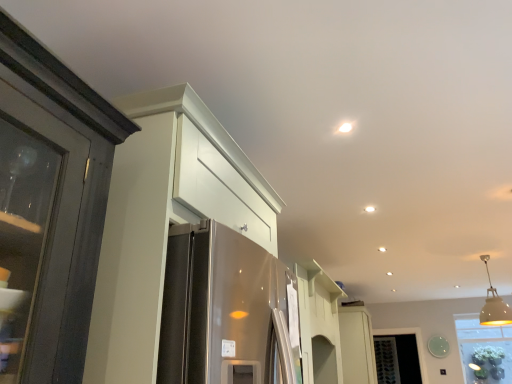
Measure the distance between point (x=505, y=312) and camera.

Point (x=505, y=312) is 4.32 meters from camera.

Identify the location of white glossy cabinet at upper left, acting as the 2th cabinetry starting from the back. (165, 221).

Is point (496, 316) positioned after point (360, 319)?

No, it is not.

Is white matte pendant light at upper right bigger than white glossy cabinet at center, the 1th cabinetry when ordered from back to front?

Incorrect, white matte pendant light at upper right is not larger than white glossy cabinet at center, the 1th cabinetry when ordered from back to front.

Is white matte pendant light at upper right next to white glossy cabinet at center, marked as the second cabinetry in a left-to-right arrangement?

No, white matte pendant light at upper right is not in contact with white glossy cabinet at center, marked as the second cabinetry in a left-to-right arrangement.

Is white glossy cabinet at center, the first cabinetry positioned from the bottom, located outside white glossy cabinet at upper left, acting as the first cabinetry starting from the front?

white glossy cabinet at center, the first cabinetry positioned from the bottom, lies outside white glossy cabinet at upper left, acting as the first cabinetry starting from the front,'s area.

From a real-world perspective, who is located lower, white glossy cabinet at center, marked as the second cabinetry in a left-to-right arrangement, or white glossy cabinet at upper left, the second cabinetry when ordered from bottom to top?

In real-world perspective, white glossy cabinet at center, marked as the second cabinetry in a left-to-right arrangement, is lower.

This screenshot has height=384, width=512. Identify the location of cabinetry above the white glossy cabinet at center, the first cabinetry positioned from the bottom (from a real-world perspective). (165, 221).

Can you confirm if white glossy cabinet at center, which is the 2th cabinetry in front-to-back order, is positioned to the left of white glossy cabinet at upper left, which ranks as the first cabinetry in top-to-bottom order?

No.

Consider the image. Is white glossy cabinet at upper left, the second cabinetry when ordered from bottom to top, outside of white matte pendant light at upper right?

Indeed, white glossy cabinet at upper left, the second cabinetry when ordered from bottom to top, is completely outside white matte pendant light at upper right.

In terms of width, does white glossy cabinet at upper left, the 1th cabinetry positioned from the left, look wider or thinner when compared to white matte pendant light at upper right?

Considering their sizes, white glossy cabinet at upper left, the 1th cabinetry positioned from the left, looks broader than white matte pendant light at upper right.

In the image, is white glossy cabinet at upper left, acting as the first cabinetry starting from the front, positioned in front of or behind white matte pendant light at upper right?

white glossy cabinet at upper left, acting as the first cabinetry starting from the front, is in front of white matte pendant light at upper right.

Can you confirm if white glossy cabinet at center, the 1th cabinetry when ordered from back to front, is positioned to the right of white matte pendant light at upper right?

In fact, white glossy cabinet at center, the 1th cabinetry when ordered from back to front, is to the left of white matte pendant light at upper right.

From the image's perspective, which object appears higher, white glossy cabinet at center, which is the 2th cabinetry in front-to-back order, or white matte pendant light at upper right?

white matte pendant light at upper right.

Considering the points (347, 344) and (489, 312), which point is in front, point (347, 344) or point (489, 312)?

The point (489, 312) is closer.

How different are the orientations of white glossy cabinet at center, the 1th cabinetry positioned from the right, and white matte pendant light at upper right in degrees?

They differ by 87.9 degrees in their facing directions.

Which is closer to the camera, (500, 306) or (264, 185)?

Point (500, 306) appears to be farther away from the viewer than point (264, 185).

From a real-world perspective, is white matte pendant light at upper right below white glossy cabinet at upper left, acting as the 2th cabinetry starting from the back?

Incorrect, from a real-world perspective, white matte pendant light at upper right is higher than white glossy cabinet at upper left, acting as the 2th cabinetry starting from the back.

Measure the distance between white matte pendant light at upper right and white glossy cabinet at upper left, the 1th cabinetry positioned from the left.

The distance of white matte pendant light at upper right from white glossy cabinet at upper left, the 1th cabinetry positioned from the left, is 3.87 meters.

How many degrees apart are the facing directions of white matte pendant light at upper right and white glossy cabinet at upper left, positioned as the second cabinetry in right-to-left order?

The angular difference between white matte pendant light at upper right and white glossy cabinet at upper left, positioned as the second cabinetry in right-to-left order, is 87.4 degrees.

From a real-world perspective, between white glossy cabinet at upper left, the second cabinetry when ordered from bottom to top, and white glossy cabinet at center, marked as the second cabinetry in a left-to-right arrangement, who is vertically lower?

white glossy cabinet at center, marked as the second cabinetry in a left-to-right arrangement, is physically lower.

Who is shorter, white glossy cabinet at upper left, the second cabinetry when ordered from bottom to top, or white glossy cabinet at center, the 1th cabinetry when ordered from back to front?

Standing shorter between the two is white glossy cabinet at upper left, the second cabinetry when ordered from bottom to top.

Choose the correct answer: Is white glossy cabinet at upper left, the 1th cabinetry positioned from the left, inside white glossy cabinet at center, which ranks as the second cabinetry in top-to-bottom order, or outside it?

white glossy cabinet at upper left, the 1th cabinetry positioned from the left, is outside white glossy cabinet at center, which ranks as the second cabinetry in top-to-bottom order.

Is white glossy cabinet at upper left, acting as the 2th cabinetry starting from the back, wider than white glossy cabinet at center, which is the 2th cabinetry in front-to-back order?

Result: Yes, white glossy cabinet at upper left, acting as the 2th cabinetry starting from the back, is wider than white glossy cabinet at center, which is the 2th cabinetry in front-to-back order.

Starting from the white matte pendant light at upper right, which cabinetry is the 1st one to the left? Please provide its 2D coordinates.

[(357, 345)]

What are the coordinates of `cabinetry behind the white glossy cabinet at upper left, the 1th cabinetry positioned from the left` in the screenshot? It's located at (357, 345).

Based on their spatial positions, is white glossy cabinet at center, marked as the second cabinetry in a left-to-right arrangement, or white glossy cabinet at upper left, acting as the first cabinetry starting from the front, closer to white matte pendant light at upper right?

white glossy cabinet at center, marked as the second cabinetry in a left-to-right arrangement, is closer to white matte pendant light at upper right.

When comparing their distances from white glossy cabinet at center, marked as the second cabinetry in a left-to-right arrangement, does white matte pendant light at upper right or white glossy cabinet at upper left, the second cabinetry when ordered from bottom to top, seem closer?

white matte pendant light at upper right.

Considering their positions, is white glossy cabinet at upper left, which ranks as the first cabinetry in top-to-bottom order, positioned closer to white matte pendant light at upper right than white glossy cabinet at center, the 1th cabinetry when ordered from back to front?

Among the two, white glossy cabinet at center, the 1th cabinetry when ordered from back to front, is located nearer to white matte pendant light at upper right.

Considering their positions, is white matte pendant light at upper right positioned closer to white glossy cabinet at upper left, the second cabinetry when ordered from bottom to top, than white glossy cabinet at center, which ranks as the second cabinetry in top-to-bottom order?

white glossy cabinet at center, which ranks as the second cabinetry in top-to-bottom order.

Consider the image. When comparing their distances from white glossy cabinet at center, the first cabinetry positioned from the bottom, does white glossy cabinet at upper left, positioned as the second cabinetry in right-to-left order, or white matte pendant light at upper right seem further?

The object further to white glossy cabinet at center, the first cabinetry positioned from the bottom, is white glossy cabinet at upper left, positioned as the second cabinetry in right-to-left order.

When comparing their distances from white glossy cabinet at upper left, positioned as the second cabinetry in right-to-left order, does white glossy cabinet at center, the first cabinetry positioned from the bottom, or white matte pendant light at upper right seem closer?

white glossy cabinet at center, the first cabinetry positioned from the bottom, is closer to white glossy cabinet at upper left, positioned as the second cabinetry in right-to-left order.

This screenshot has width=512, height=384. What are the coordinates of `light fixture between white glossy cabinet at upper left, which ranks as the first cabinetry in top-to-bottom order, and white glossy cabinet at center, the first cabinetry positioned from the bottom, in the front-back direction` in the screenshot? It's located at (494, 305).